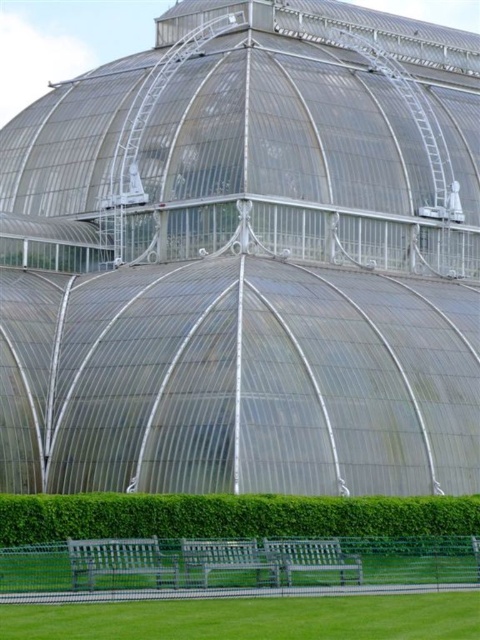
Is green metallic bench at lower center above green wooden bench at lower center?

Incorrect, green metallic bench at lower center is not positioned above green wooden bench at lower center.

From the picture: Between green metallic bench at lower center and green wooden bench at lower center, which one has more height?

green metallic bench at lower center is taller.

Who is more distant from viewer, (79, 545) or (240, 564)?

The point (240, 564) is more distant.

At what (x,y) coordinates should I click in order to perform the action: click on green metallic bench at lower center. Please return your answer as a coordinate pair (x, y). Looking at the image, I should click on 118,561.

Can you confirm if green grass football field at lower center is positioned above wooden park bench at lower center?

Incorrect, green grass football field at lower center is not positioned above wooden park bench at lower center.

Does green grass football field at lower center have a larger size compared to wooden park bench at lower center?

Correct, green grass football field at lower center is larger in size than wooden park bench at lower center.

This screenshot has width=480, height=640. Identify the location of green grass football field at lower center. (252, 618).

Where is `green grass football field at lower center`? This screenshot has width=480, height=640. green grass football field at lower center is located at coordinates (x=252, y=618).

Does point (85, 522) come in front of point (143, 548)?

That is False.

Locate an element on the screen. The image size is (480, 640). green leafy hedge at lower center is located at coordinates (232, 516).